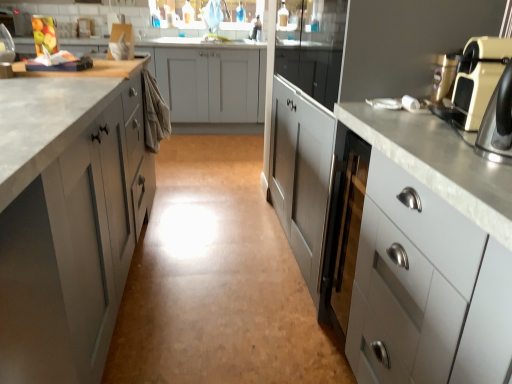
Question: From a real-world perspective, is beige plastic toaster at right located higher than matte silver faucet at upper center?

Choices:
 (A) no
 (B) yes

Answer: (A)

Question: Is beige plastic toaster at right next to matte silver faucet at upper center?

Choices:
 (A) no
 (B) yes

Answer: (A)

Question: Considering the relative positions of beige plastic toaster at right and matte silver faucet at upper center in the image provided, is beige plastic toaster at right to the right of matte silver faucet at upper center from the viewer's perspective?

Choices:
 (A) yes
 (B) no

Answer: (A)

Question: Does beige plastic toaster at right have a greater width compared to matte silver faucet at upper center?

Choices:
 (A) yes
 (B) no

Answer: (B)

Question: Can you confirm if beige plastic toaster at right is smaller than matte silver faucet at upper center?

Choices:
 (A) no
 (B) yes

Answer: (B)

Question: Is matte silver faucet at upper center to the left or to the right of satin white cabinet at right, marked as the second cabinetry in a left-to-right arrangement, in the image?

Choices:
 (A) left
 (B) right

Answer: (A)

Question: Looking at their shapes, would you say matte silver faucet at upper center is wider or thinner than satin white cabinet at right, the 2th cabinetry from the right?

Choices:
 (A) thin
 (B) wide

Answer: (A)

Question: In terms of size, does matte silver faucet at upper center appear bigger or smaller than satin white cabinet at right, marked as the second cabinetry in a left-to-right arrangement?

Choices:
 (A) big
 (B) small

Answer: (B)

Question: From the image's perspective, is matte silver faucet at upper center positioned above or below satin white cabinet at right, marked as the second cabinetry in a left-to-right arrangement?

Choices:
 (A) above
 (B) below

Answer: (A)

Question: Is beige plastic toaster at right inside or outside of metallic gold coffee machine at upper right?

Choices:
 (A) inside
 (B) outside

Answer: (B)

Question: Considering the positions of point (466, 52) and point (441, 74), is point (466, 52) closer or farther from the camera than point (441, 74)?

Choices:
 (A) farther
 (B) closer

Answer: (B)

Question: Is beige plastic toaster at right in front of or behind metallic gold coffee machine at upper right in the image?

Choices:
 (A) behind
 (B) front

Answer: (B)

Question: From their relative heights in the image, would you say beige plastic toaster at right is taller or shorter than metallic gold coffee machine at upper right?

Choices:
 (A) short
 (B) tall

Answer: (B)

Question: Choose the correct answer: Is beige plastic toaster at right inside white glossy cabinet at right, which ranks as the third cabinetry in left-to-right order, or outside it?

Choices:
 (A) outside
 (B) inside

Answer: (A)

Question: From a real-world perspective, is beige plastic toaster at right physically located above or below white glossy cabinet at right, which ranks as the 1th cabinetry in right-to-left order?

Choices:
 (A) below
 (B) above

Answer: (B)